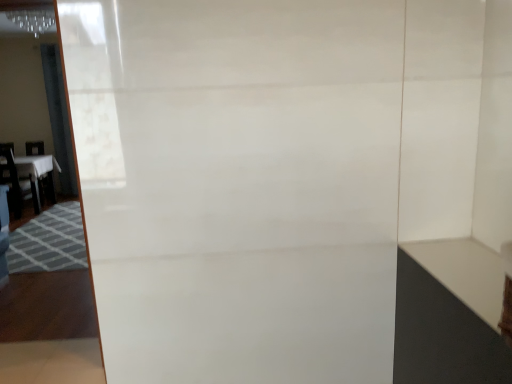
The width and height of the screenshot is (512, 384). Describe the element at coordinates (12, 178) in the screenshot. I see `wooden chair at left` at that location.

This screenshot has height=384, width=512. Find the location of `wooden chair at left`. wooden chair at left is located at coordinates (12, 178).

I want to click on wooden chair at left, so click(12, 178).